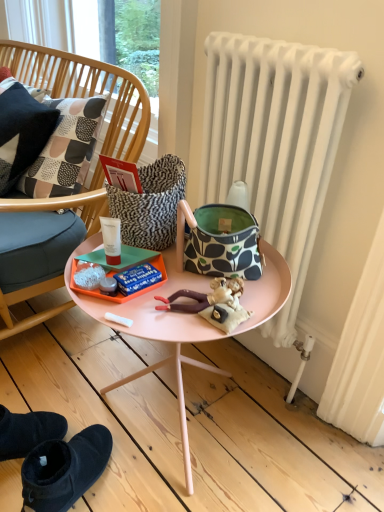
Question: Considering the positions of patterned fabric pillow at left and patterned fabric handbag at center in the image, is patterned fabric pillow at left taller or shorter than patterned fabric handbag at center?

Choices:
 (A) short
 (B) tall

Answer: (B)

Question: Considering the positions of patterned fabric pillow at left and patterned fabric handbag at center in the image, is patterned fabric pillow at left wider or thinner than patterned fabric handbag at center?

Choices:
 (A) thin
 (B) wide

Answer: (B)

Question: Considering the real-world distances, which object is closest to the wooden chair at left?

Choices:
 (A) patterned fabric handbag at center
 (B) patterned fabric pillow at left
 (C) white matte radiator at right
 (D) pink matte table at center

Answer: (B)

Question: Which of these objects is positioned closest to the patterned fabric handbag at center?

Choices:
 (A) pink matte table at center
 (B) wooden chair at left
 (C) white matte radiator at right
 (D) patterned fabric pillow at left

Answer: (A)